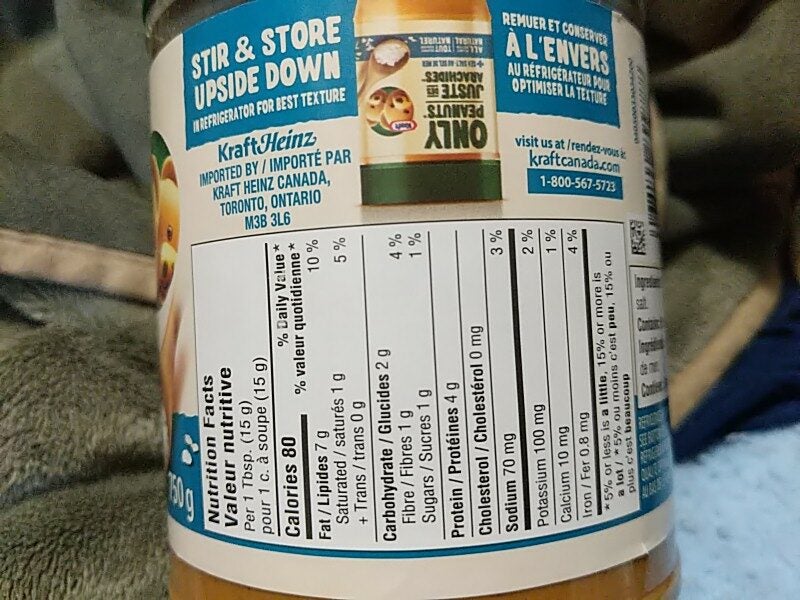
Where is `olive green blanket`? olive green blanket is located at coordinates (85, 393), (57, 187).